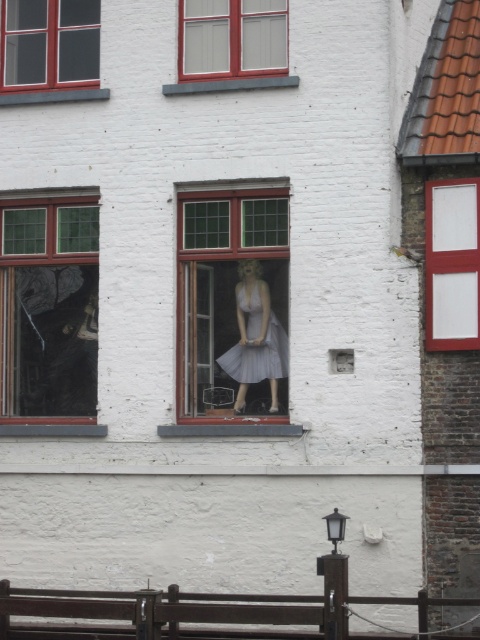
Which is in front, point (188, 61) or point (243, 435)?

Positioned in front is point (243, 435).

Who is shorter, white glass window at upper center or smooth concrete window sill at center?

With less height is smooth concrete window sill at center.

Is point (181, 33) more distant than point (273, 435)?

Yes, it is behind point (273, 435).

Image resolution: width=480 pixels, height=640 pixels. In order to click on white glass window at upper center in this screenshot , I will do `click(231, 36)`.

Is point (453, 244) less distant than point (235, 369)?

Yes.

Is point (445, 316) positioned before point (239, 300)?

Yes.

This screenshot has height=640, width=480. I want to click on white glass window at upper right, so click(x=452, y=264).

Is matte red window at upper left above white glass window at upper center?

Indeed, matte red window at upper left is positioned over white glass window at upper center.

Can you confirm if matte red window at upper left is positioned to the right of white glass window at upper center?

No, matte red window at upper left is not to the right of white glass window at upper center.

Measure the distance between point (x=96, y=6) and camera.

22.25 meters

You are a GUI agent. You are given a task and a screenshot of the screen. Output one action in this format:
    pyautogui.click(x=<x>, y=<y>)
    Task: Click on the matte red window at upper left
    The image size is (480, 640).
    Given the screenshot: What is the action you would take?
    pyautogui.click(x=49, y=44)